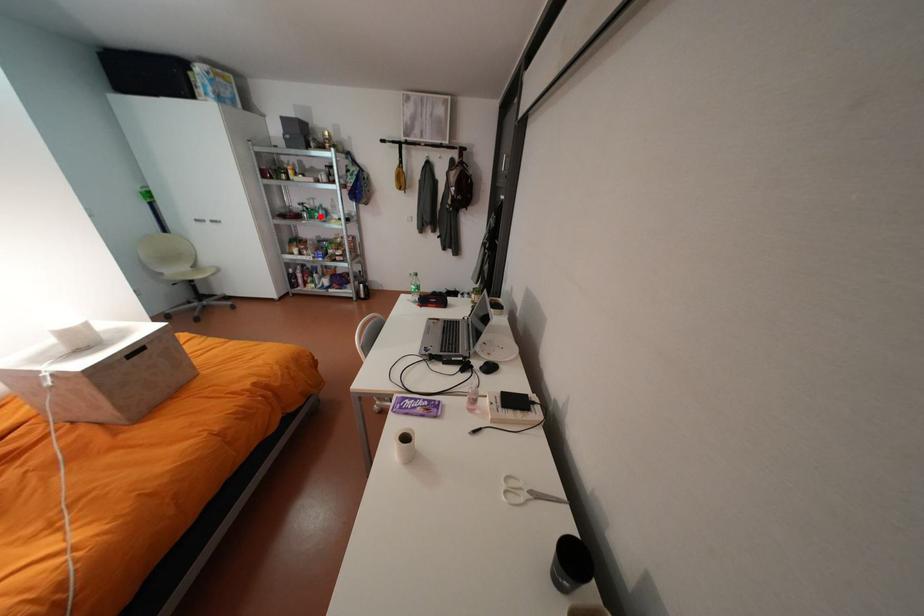
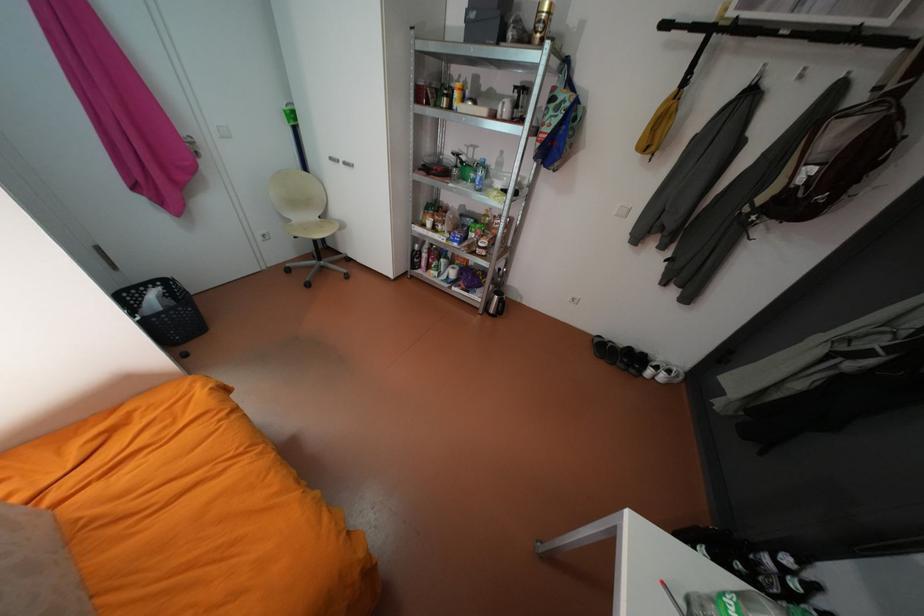
Question: I am providing you with two images of the same scene from different viewpoints. A red point is shown in image1. For the corresponding object point in image2, is it positioned nearer or farther from the camera?

Choices:
 (A) Nearer
 (B) Farther

Answer: (A)